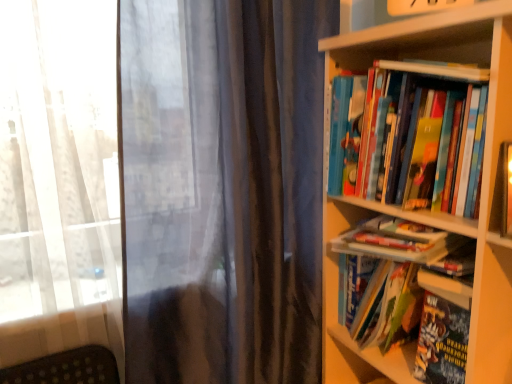
Question: Should I look upward or downward to see hardcover book at center, the 2th book ordered from the bottom?

Choices:
 (A) up
 (B) down

Answer: (B)

Question: Should I look upward or downward to see hardcover book at right, which ranks as the fifth book in top-to-bottom order?

Choices:
 (A) down
 (B) up

Answer: (A)

Question: Does hardcover books at right, which appears as the first book when viewed from the top, appear on the left side of hardcover book at right, which ranks as the fifth book in top-to-bottom order?

Choices:
 (A) yes
 (B) no

Answer: (A)

Question: Is hardcover books at right, the 5th book in the bottom-to-top sequence, turned away from hardcover book at right, the 1th book ordered from the bottom?

Choices:
 (A) yes
 (B) no

Answer: (B)

Question: Is hardcover books at right, which appears as the first book when viewed from the top, shorter than hardcover book at right, which ranks as the fifth book in top-to-bottom order?

Choices:
 (A) no
 (B) yes

Answer: (A)

Question: From the image's perspective, would you say hardcover books at right, the 5th book in the bottom-to-top sequence, is positioned over hardcover book at right, the 1th book ordered from the bottom?

Choices:
 (A) yes
 (B) no

Answer: (A)

Question: Can you confirm if hardcover books at right, which appears as the first book when viewed from the top, is wider than hardcover book at right, the 1th book ordered from the bottom?

Choices:
 (A) no
 (B) yes

Answer: (B)

Question: Are hardcover books at right, which appears as the first book when viewed from the top, and hardcover book at right, the 1th book ordered from the bottom, located far from each other?

Choices:
 (A) no
 (B) yes

Answer: (A)

Question: Is the position of white matte bookshelf at right less distant than that of hardcover book at right, the 1th book ordered from the bottom?

Choices:
 (A) no
 (B) yes

Answer: (B)

Question: Considering the relative sizes of white matte bookshelf at right and hardcover book at right, the 1th book ordered from the bottom, in the image provided, is white matte bookshelf at right smaller than hardcover book at right, the 1th book ordered from the bottom,?

Choices:
 (A) yes
 (B) no

Answer: (B)

Question: Is white matte bookshelf at right next to hardcover book at right, which ranks as the fifth book in top-to-bottom order, and touching it?

Choices:
 (A) yes
 (B) no

Answer: (B)

Question: Is white matte bookshelf at right taller than hardcover book at right, which ranks as the fifth book in top-to-bottom order?

Choices:
 (A) no
 (B) yes

Answer: (B)

Question: From the image's perspective, would you say white matte bookshelf at right is shown under hardcover book at right, which ranks as the fifth book in top-to-bottom order?

Choices:
 (A) yes
 (B) no

Answer: (B)

Question: From a real-world perspective, does white matte bookshelf at right sit lower than hardcover book at right, which ranks as the fifth book in top-to-bottom order?

Choices:
 (A) yes
 (B) no

Answer: (B)

Question: Is hardcover book at center right, the 4th book ordered from the bottom, wider than hardcover book at center, the 2th book ordered from the bottom?

Choices:
 (A) yes
 (B) no

Answer: (B)